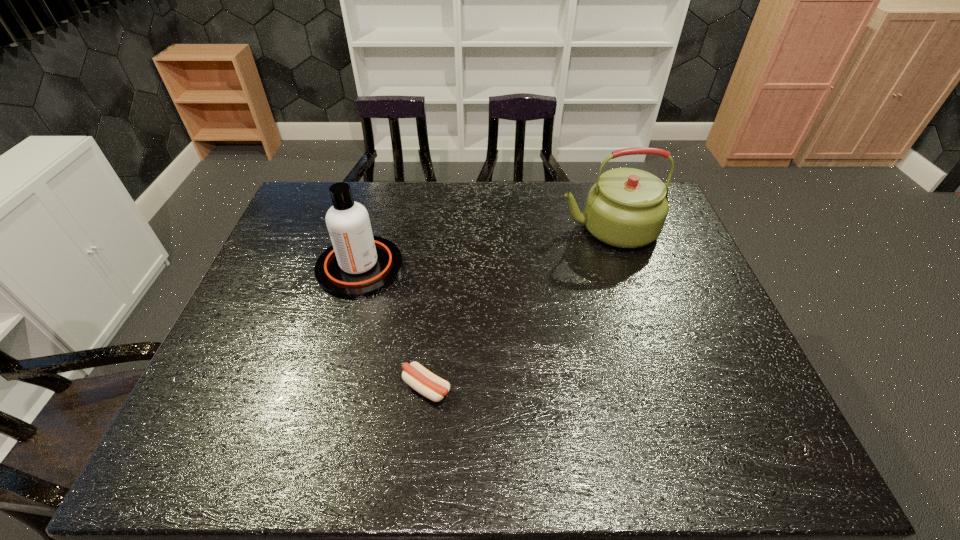
Locate an element on the screen. The image size is (960, 540). the rightmost object is located at coordinates (626, 208).

This screenshot has width=960, height=540. I want to click on cleansing agent, so click(x=357, y=264).

The image size is (960, 540). What are the coordinates of `sausage` in the screenshot? It's located at (423, 381).

Locate an element on the screen. The height and width of the screenshot is (540, 960). the second object from right to left is located at coordinates (423, 381).

At what (x,y) coordinates should I click in order to perform the action: click on vacant area located 0.200m at the spout of the kettle. Please return your answer as a coordinate pair (x, y). The width and height of the screenshot is (960, 540). Looking at the image, I should click on (497, 228).

Find the location of a particular element. This screenshot has width=960, height=540. free region located 0.220m at the spout of the kettle is located at coordinates (492, 228).

Locate an element on the screen. This screenshot has height=540, width=960. free space located at the spout of the kettle is located at coordinates (457, 228).

At what (x,y) coordinates should I click in order to perform the action: click on free location located on the right of the leftmost object. Please return your answer as a coordinate pair (x, y). This screenshot has height=540, width=960. Looking at the image, I should click on (430, 267).

What are the coordinates of `vacant space located on the left of the nearest object` in the screenshot? It's located at [x=358, y=388].

Locate an element on the screen. The height and width of the screenshot is (540, 960). object present at the far edge is located at coordinates [x=626, y=208].